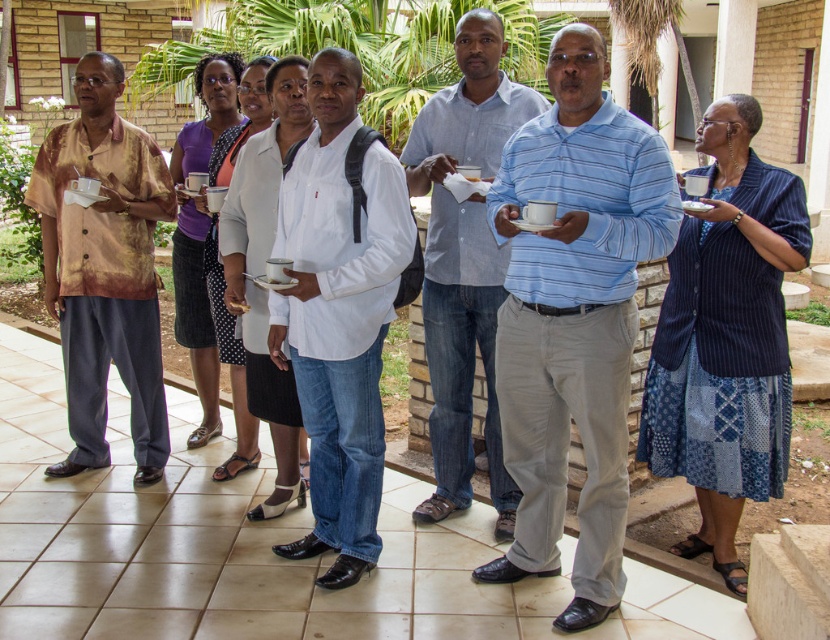
The image size is (830, 640). Describe the element at coordinates (105, 268) in the screenshot. I see `matte brown shirt at left` at that location.

I want to click on matte brown shirt at left, so click(x=105, y=268).

Identify the location of matte brown shirt at left. The image size is (830, 640). (105, 268).

Can you confirm if light blue striped shirt at center is thinner than blue cotton shirt at center?

In fact, light blue striped shirt at center might be wider than blue cotton shirt at center.

Does light blue striped shirt at center have a lesser height compared to blue cotton shirt at center?

Indeed, light blue striped shirt at center has a lesser height compared to blue cotton shirt at center.

The width and height of the screenshot is (830, 640). Find the location of `light blue striped shirt at center`. light blue striped shirt at center is located at coordinates (574, 317).

Can you confirm if light blue striped shirt at center is positioned to the right of white matte shirt at center?

Indeed, light blue striped shirt at center is positioned on the right side of white matte shirt at center.

Does light blue striped shirt at center appear on the left side of white matte shirt at center?

In fact, light blue striped shirt at center is to the right of white matte shirt at center.

What do you see at coordinates (574, 317) in the screenshot?
I see `light blue striped shirt at center` at bounding box center [574, 317].

Find the location of `light blue striped shirt at center`. light blue striped shirt at center is located at coordinates (574, 317).